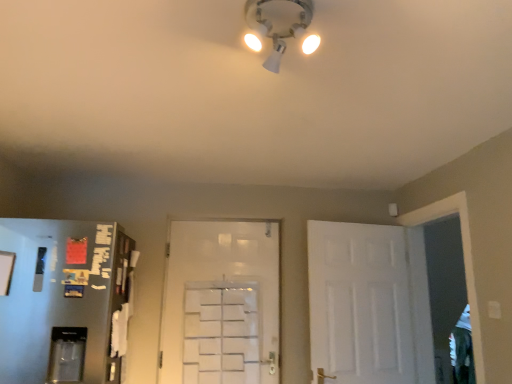
Identify the location of white matte door at center, marked as the second door in a right-to-left arrangement. This screenshot has width=512, height=384. (221, 303).

What do you see at coordinates (365, 301) in the screenshot? The width and height of the screenshot is (512, 384). I see `white matte door at right, which is counted as the 1th door, starting from the right` at bounding box center [365, 301].

Where is `white matte door at center, the 1th door when ordered from left to right`? white matte door at center, the 1th door when ordered from left to right is located at coordinates (221, 303).

Is white matte door at center, the 1th door when ordered from left to right, facing towards white plastic light fixture at upper center?

Yes, white matte door at center, the 1th door when ordered from left to right, is oriented towards white plastic light fixture at upper center.

Which of these two, white matte door at center, marked as the second door in a right-to-left arrangement, or white plastic light fixture at upper center, is smaller?

white plastic light fixture at upper center.

Is white plastic light fixture at upper center located within white matte door at center, the 1th door when ordered from left to right?

Definitely not — white plastic light fixture at upper center is not inside white matte door at center, the 1th door when ordered from left to right.

Which of these two, white matte door at center, the 1th door when ordered from left to right, or white plastic light fixture at upper center, stands shorter?

Standing shorter between the two is white plastic light fixture at upper center.

From a real-world perspective, is white plastic light fixture at upper center positioned under white matte door at right, the 2th door when ordered from left to right, based on gravity?

No, from a real-world perspective, white plastic light fixture at upper center is not beneath white matte door at right, the 2th door when ordered from left to right.

Is white plastic light fixture at upper center turned away from white matte door at right, the 2th door when ordered from left to right?

white plastic light fixture at upper center does not have its back to white matte door at right, the 2th door when ordered from left to right.

Where is `light fixture on the left of the white matte door at right, which is counted as the 1th door, starting from the right`? The width and height of the screenshot is (512, 384). light fixture on the left of the white matte door at right, which is counted as the 1th door, starting from the right is located at coordinates (272, 27).

Between white matte door at right, which is counted as the 1th door, starting from the right, and white matte door at center, the 1th door when ordered from left to right, which one has smaller width?

With smaller width is white matte door at center, the 1th door when ordered from left to right.

Is white matte door at right, which is counted as the 1th door, starting from the right, not close to white matte door at center, marked as the second door in a right-to-left arrangement?

That's not correct — white matte door at right, which is counted as the 1th door, starting from the right, is a little close to white matte door at center, marked as the second door in a right-to-left arrangement.

Does point (352, 268) come in front of point (236, 256)?

Yes, it is in front of point (236, 256).

Looking at this image, considering their positions, is white matte door at right, which is counted as the 1th door, starting from the right, located in front of or behind white plastic light fixture at upper center?

Visually, white matte door at right, which is counted as the 1th door, starting from the right, is located behind white plastic light fixture at upper center.

Is white matte door at right, the 2th door when ordered from left to right, taller than white plastic light fixture at upper center?

Correct, white matte door at right, the 2th door when ordered from left to right, is much taller as white plastic light fixture at upper center.

Is white matte door at right, which is counted as the 1th door, starting from the right, wider or thinner than white plastic light fixture at upper center?

In the image, white matte door at right, which is counted as the 1th door, starting from the right, appears to be more narrow than white plastic light fixture at upper center.

Based on their positions, is white matte door at center, marked as the second door in a right-to-left arrangement, located to the left or right of white matte door at right, which is counted as the 1th door, starting from the right?

In the image, white matte door at center, marked as the second door in a right-to-left arrangement, appears on the left side of white matte door at right, which is counted as the 1th door, starting from the right.

Does white matte door at center, the 1th door when ordered from left to right, have a greater width compared to white matte door at right, which is counted as the 1th door, starting from the right?

In fact, white matte door at center, the 1th door when ordered from left to right, might be narrower than white matte door at right, which is counted as the 1th door, starting from the right.

Can you see white matte door at center, marked as the second door in a right-to-left arrangement, touching white matte door at right, which is counted as the 1th door, starting from the right?

No, white matte door at center, marked as the second door in a right-to-left arrangement, is not beside white matte door at right, which is counted as the 1th door, starting from the right.

The image size is (512, 384). What are the coordinates of `door located on the left of white matte door at right, the 2th door when ordered from left to right` in the screenshot? It's located at (221, 303).

Choose the correct answer: Is white plastic light fixture at upper center inside white matte door at center, marked as the second door in a right-to-left arrangement, or outside it?

white plastic light fixture at upper center is not inside white matte door at center, marked as the second door in a right-to-left arrangement, it's outside.

From a real-world perspective, is white plastic light fixture at upper center physically above white matte door at center, marked as the second door in a right-to-left arrangement?

Yes, from a real-world perspective, white plastic light fixture at upper center is over white matte door at center, marked as the second door in a right-to-left arrangement

Is white plastic light fixture at upper center facing away from white matte door at center, marked as the second door in a right-to-left arrangement?

No, white plastic light fixture at upper center is not facing the opposite direction of white matte door at center, marked as the second door in a right-to-left arrangement.

What's the angular difference between white plastic light fixture at upper center and white matte door at center, marked as the second door in a right-to-left arrangement,'s facing directions?

white plastic light fixture at upper center and white matte door at center, marked as the second door in a right-to-left arrangement, are facing 84.3 degrees away from each other.

Locate an element on the screen. This screenshot has width=512, height=384. light fixture that is on the right side of white matte door at center, marked as the second door in a right-to-left arrangement is located at coordinates (272, 27).

Identify the location of light fixture in front of the white matte door at right, which is counted as the 1th door, starting from the right. (272, 27).

When comparing their distances from white plastic light fixture at upper center, does white matte door at center, the 1th door when ordered from left to right, or white matte door at right, the 2th door when ordered from left to right, seem closer?

The object closer to white plastic light fixture at upper center is white matte door at right, the 2th door when ordered from left to right.

From the image, which object appears to be nearer to white matte door at right, which is counted as the 1th door, starting from the right, white plastic light fixture at upper center or white matte door at center, marked as the second door in a right-to-left arrangement?

white matte door at center, marked as the second door in a right-to-left arrangement, lies closer to white matte door at right, which is counted as the 1th door, starting from the right, than the other object.

Considering their positions, is white matte door at right, which is counted as the 1th door, starting from the right, positioned further to white matte door at center, marked as the second door in a right-to-left arrangement, than white plastic light fixture at upper center?

white plastic light fixture at upper center is positioned further to the anchor white matte door at center, marked as the second door in a right-to-left arrangement.

Considering their positions, is white matte door at right, which is counted as the 1th door, starting from the right, positioned closer to white plastic light fixture at upper center than white matte door at center, the 1th door when ordered from left to right?

Based on the image, white matte door at right, which is counted as the 1th door, starting from the right, appears to be nearer to white plastic light fixture at upper center.

Estimate the real-world distances between objects in this image. Which object is further from white matte door at right, which is counted as the 1th door, starting from the right, white matte door at center, the 1th door when ordered from left to right, or white plastic light fixture at upper center?

Among the two, white plastic light fixture at upper center is located further to white matte door at right, which is counted as the 1th door, starting from the right.

From the picture: Considering their positions, is white plastic light fixture at upper center positioned further to white matte door at center, marked as the second door in a right-to-left arrangement, than white matte door at right, which is counted as the 1th door, starting from the right?

The object further to white matte door at center, marked as the second door in a right-to-left arrangement, is white plastic light fixture at upper center.

The width and height of the screenshot is (512, 384). I want to click on door between white plastic light fixture at upper center and white matte door at center, marked as the second door in a right-to-left arrangement, from front to back, so click(x=365, y=301).